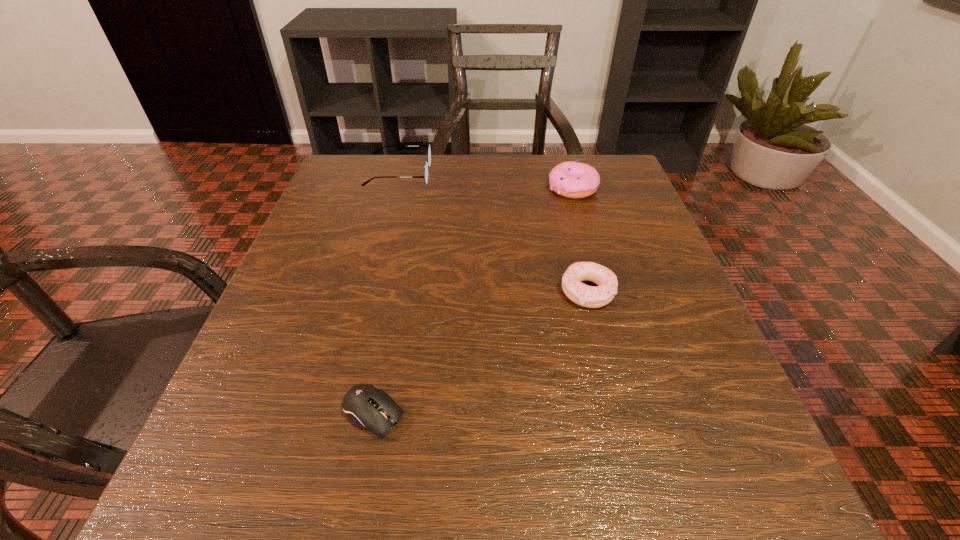
I want to click on blank region between the shorter doughnut and the farther doughnut, so click(x=580, y=240).

Where is `free space between the spectacles and the computer mouse`? This screenshot has height=540, width=960. free space between the spectacles and the computer mouse is located at coordinates [x=387, y=294].

Image resolution: width=960 pixels, height=540 pixels. I want to click on empty location between the taller doughnut and the nearest object, so click(x=473, y=301).

Image resolution: width=960 pixels, height=540 pixels. In order to click on free space between the farther doughnut and the nearer doughnut in this screenshot , I will do `click(580, 240)`.

Where is `blank region between the nearer doughnut and the farther doughnut`? This screenshot has height=540, width=960. blank region between the nearer doughnut and the farther doughnut is located at coordinates (580, 240).

Where is `vacant area that lies between the spectacles and the farther doughnut`? The image size is (960, 540). vacant area that lies between the spectacles and the farther doughnut is located at coordinates (486, 181).

Find the location of a particular element. vacant region between the spectacles and the taller doughnut is located at coordinates (486, 181).

Locate an element on the screen. vacant area that lies between the spectacles and the computer mouse is located at coordinates (387, 294).

Locate an element on the screen. This screenshot has height=540, width=960. free space that is in between the computer mouse and the farther doughnut is located at coordinates (473, 301).

This screenshot has width=960, height=540. What are the coordinates of `unoccupied position between the third farthest object and the computer mouse` in the screenshot? It's located at (481, 353).